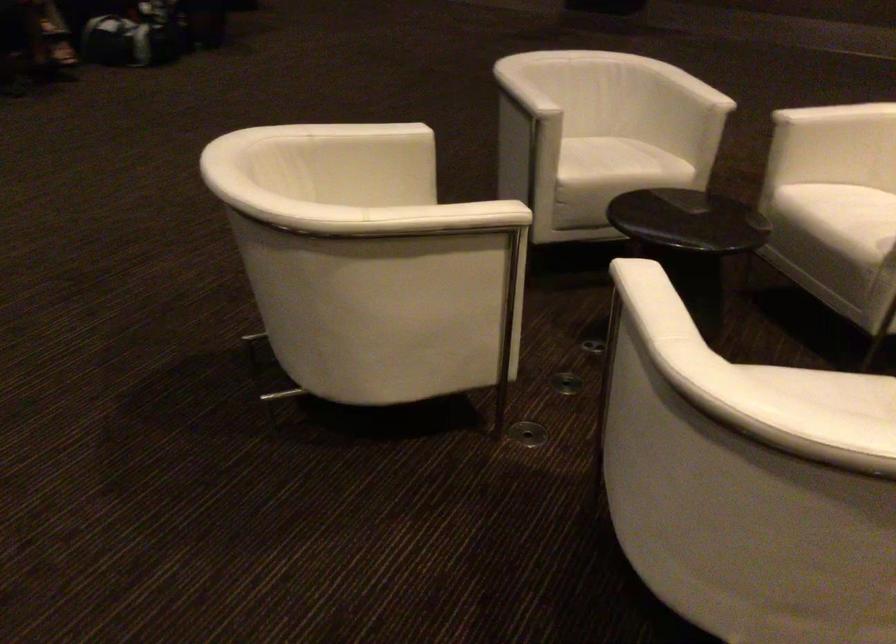
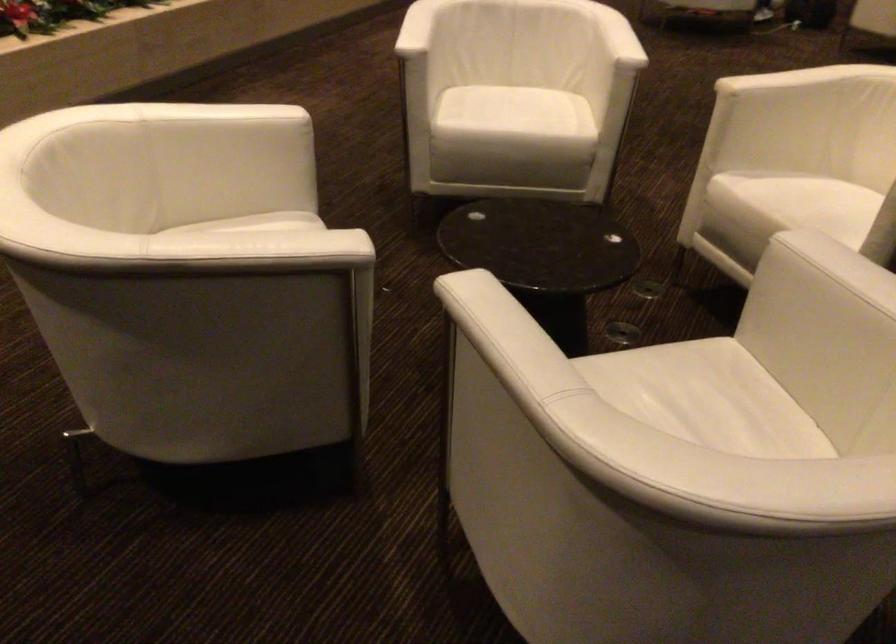
Locate, in the second image, the point that corresponds to pixel 573 149 in the first image.

(686, 388)